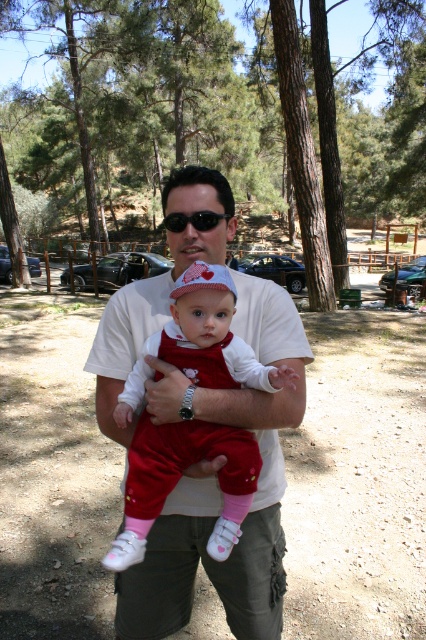
Question: Estimate the real-world distances between objects in this image. Which object is closer to the matte red onesie at center?

Choices:
 (A) white matte hand at center
 (B) matte white hand at center

Answer: (B)

Question: Does matte red onesie at center have a greater width compared to matte white hand at center?

Choices:
 (A) no
 (B) yes

Answer: (B)

Question: Which object appears closest to the camera in this image?

Choices:
 (A) white matte skin at center
 (B) matte red onesie at center

Answer: (A)

Question: In this image, where is matte red onesie at center located relative to white matte hand at center?

Choices:
 (A) below
 (B) above

Answer: (B)

Question: Which object is closer to the camera taking this photo?

Choices:
 (A) white matte hand at center
 (B) matte white hand at center

Answer: (B)

Question: Is matte white hand at center closer to the viewer compared to white matte skin at center?

Choices:
 (A) no
 (B) yes

Answer: (A)